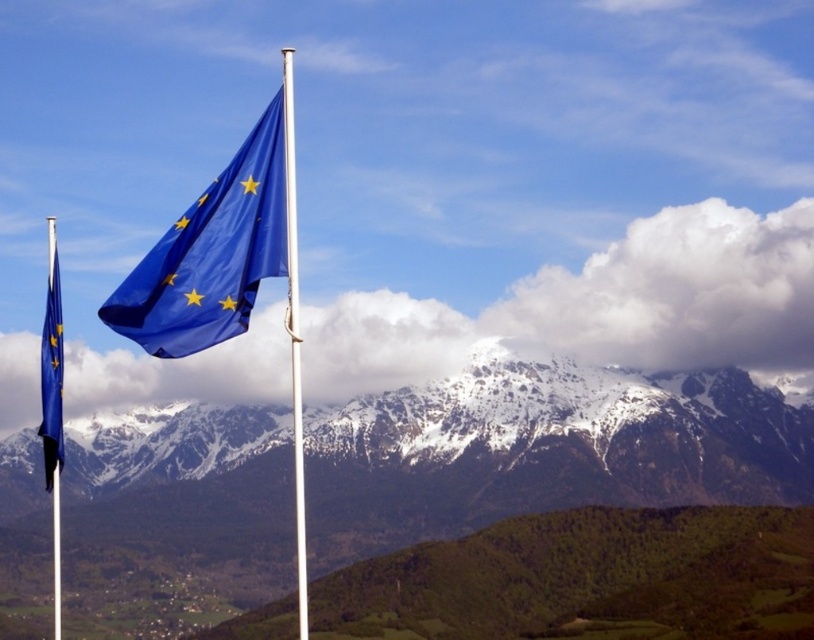
Question: Can you confirm if blue fabric flag at upper center is smaller than white metallic flag pole at center?

Choices:
 (A) no
 (B) yes

Answer: (A)

Question: Is blue fabric flag at upper center bigger than white metallic flag pole at center?

Choices:
 (A) no
 (B) yes

Answer: (B)

Question: Estimate the real-world distances between objects in this image. Which object is closer to the blue fabric flag at upper center?

Choices:
 (A) white metallic flag pole at center
 (B) matte blue flag at left

Answer: (A)

Question: Which point appears farthest from the camera in this image?

Choices:
 (A) (204, 262)
 (B) (42, 342)

Answer: (B)

Question: Does blue fabric flag at upper center have a smaller size compared to matte blue flag at left?

Choices:
 (A) yes
 (B) no

Answer: (B)

Question: Among these objects, which one is farthest from the camera?

Choices:
 (A) blue fabric flag at upper center
 (B) white metallic flag pole at center
 (C) matte blue flag at left

Answer: (C)